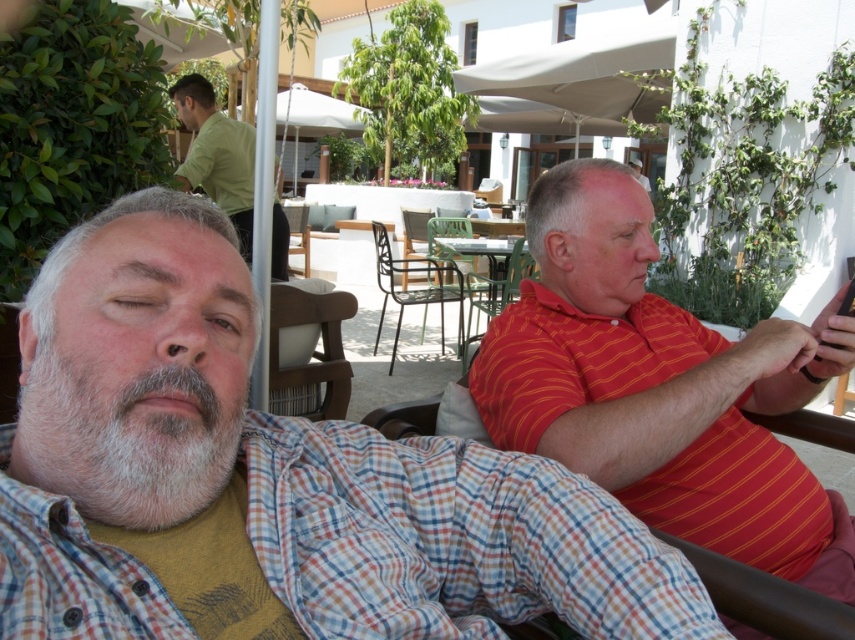
Question: Observing the image, what is the correct spatial positioning of red striped polo shirt at right in reference to brown fabric chair at center?

Choices:
 (A) below
 (B) above

Answer: (B)

Question: Which of these objects is positioned farthest from the metallic green chair at center?

Choices:
 (A) metallic black chair at center
 (B) black wrought iron chair at center
 (C) green matte shirt at upper left
 (D) wooden chair at center

Answer: (D)

Question: Which is nearer to the black wrought iron chair at center?

Choices:
 (A) wooden chair at center
 (B) red striped polo shirt at right
 (C) metallic black chair at center

Answer: (C)

Question: Which point is farther to the camera?

Choices:
 (A) (278, 307)
 (B) (472, 300)

Answer: (B)

Question: Does red striped polo shirt at right have a lesser width compared to brown fabric chair at center?

Choices:
 (A) no
 (B) yes

Answer: (A)

Question: Is checkered shirt at center to the left of wooden chair at center from the viewer's perspective?

Choices:
 (A) no
 (B) yes

Answer: (A)